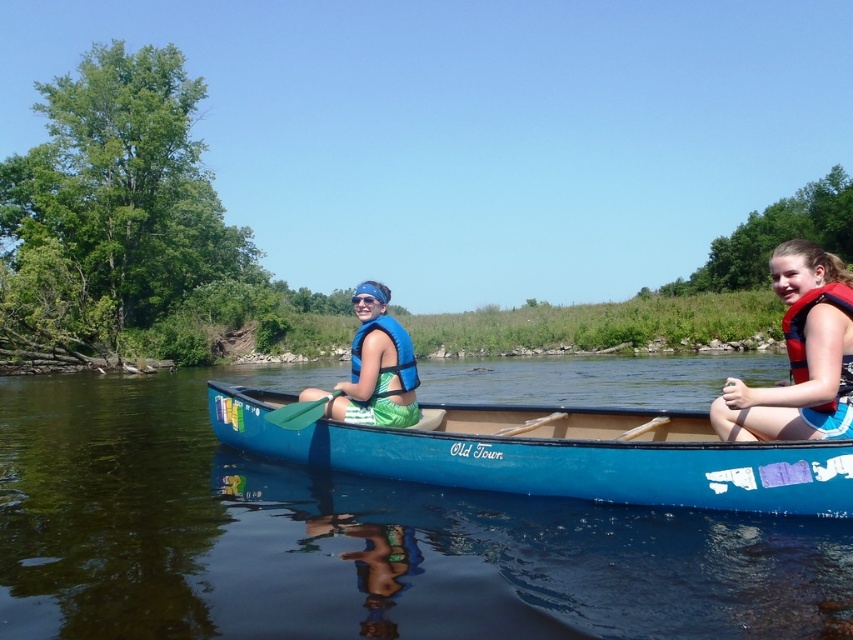
You are planning to take a family of four on a short canoe trip. The blue plastic canoe at center and the blue wood canoe at center are available. Which canoe would be more suitable for the family to sit comfortably?

The blue plastic canoe at center is more suitable because it has a larger size compared to the blue wood canoe at center, providing more space for the family of four.

You are a safety inspector checking the life vests and jackets in the canoe. You notice the red life vest at right and the orange life jacket at right. According to safety regulations, life vests must be placed above life jackets for quick access. Is the current arrangement compliant?

The red life vest at right is below orange life jacket at right, which violates the safety regulation requiring life vests to be placed above life jackets for quick access. The arrangement is not compliant.